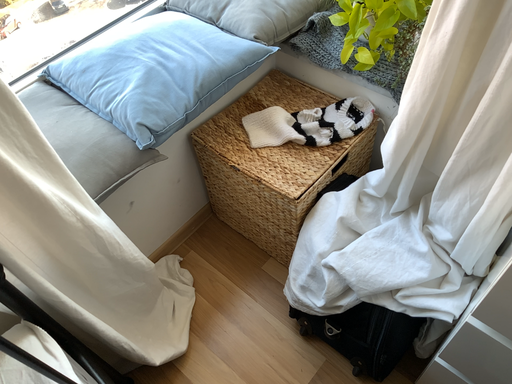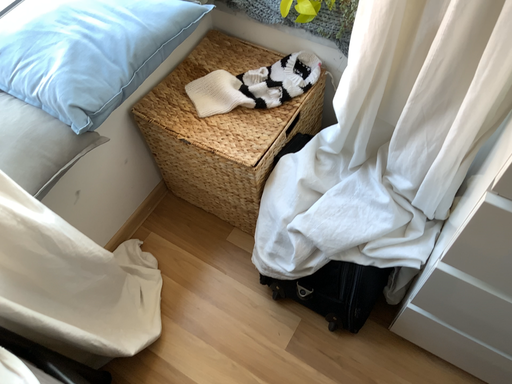
Question: How did the camera likely rotate when shooting the video?

Choices:
 (A) rotated left
 (B) rotated right

Answer: (B)